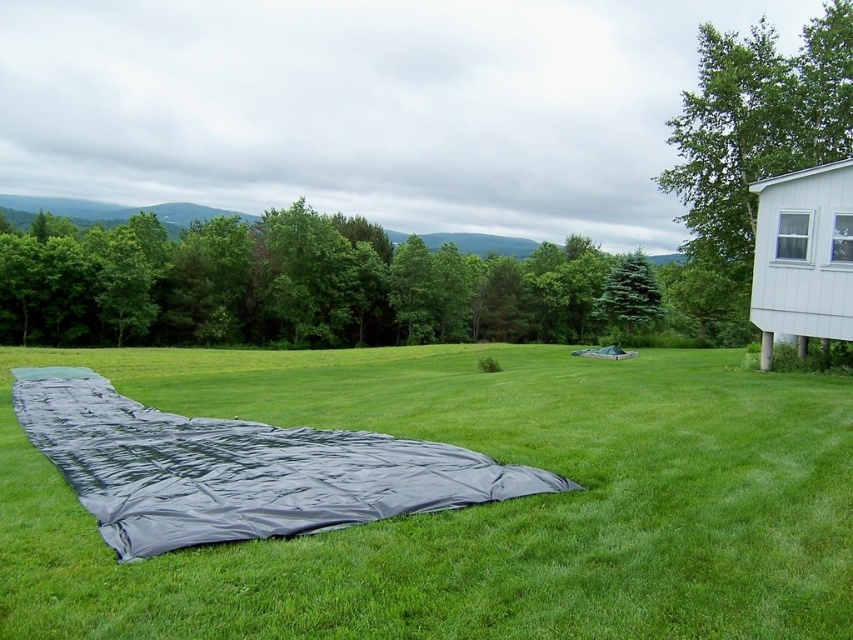
You are planning to set up a picnic and have a black tarp at center and a green leafy tree at upper right in your view. Which object is shorter?

The black tarp at center is not as tall as the green leafy tree at upper right, so the black tarp at center is shorter.